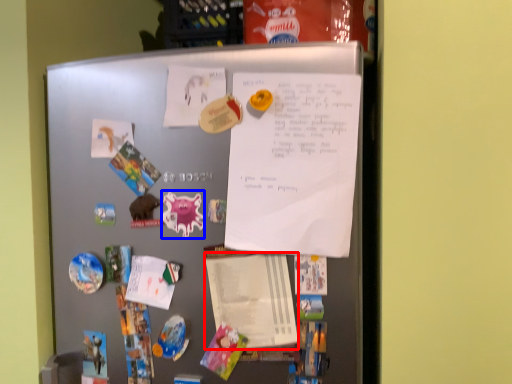
Question: Which object is further to the camera taking this photo, notepad (highlighted by a red box) or art (highlighted by a blue box)?

Choices:
 (A) notepad
 (B) art

Answer: (B)